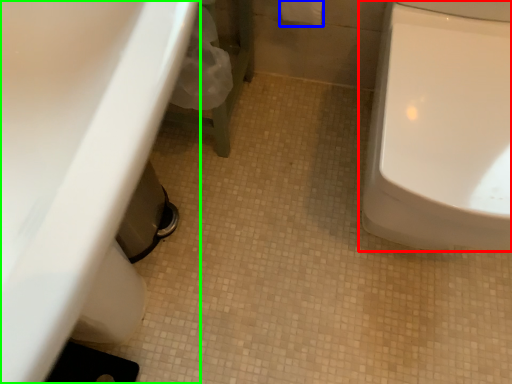
Question: Which is farther away from toilet (highlighted by a red box)? toilet paper (highlighted by a blue box) or sink (highlighted by a green box)?

Choices:
 (A) toilet paper
 (B) sink

Answer: (B)